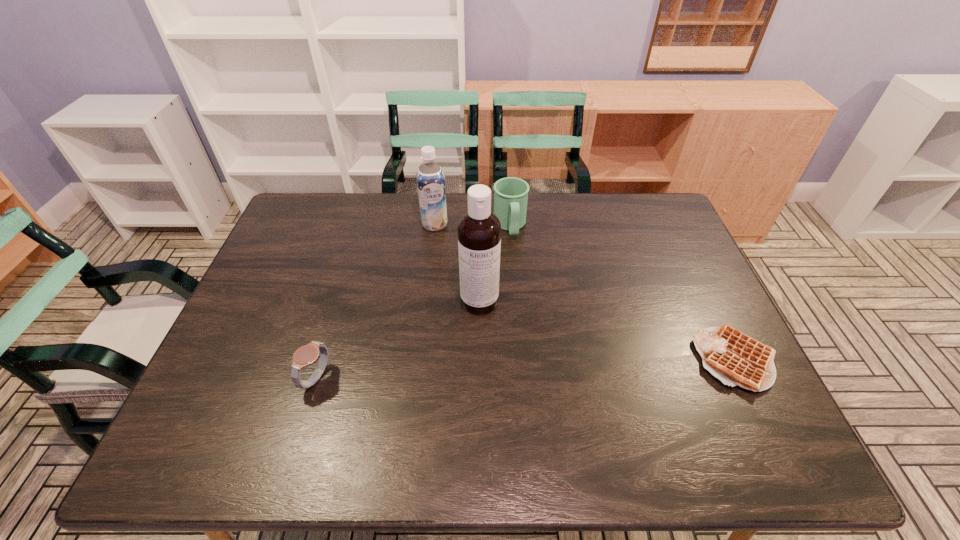
This screenshot has height=540, width=960. I want to click on vacant space on the desktop that is between the leftmost object and the shortest object and is positioned on the side of the third tallest object with the handle, so click(x=540, y=369).

At what (x,y) coordinates should I click in order to perform the action: click on free spot on the desktop that is between the fourth tallest object and the shortest object and is positioned on the label side of the tallest object. Please return your answer as a coordinate pair (x, y). This screenshot has height=540, width=960. Looking at the image, I should click on point(493,370).

You are a GUI agent. You are given a task and a screenshot of the screen. Output one action in this format:
    pyautogui.click(x=<x>, y=<y>)
    Task: Click on the free space on the desktop that is between the leftmost object and the waffle and is positioned on the label of the soya milk
    
    Given the screenshot: What is the action you would take?
    pyautogui.click(x=470, y=372)